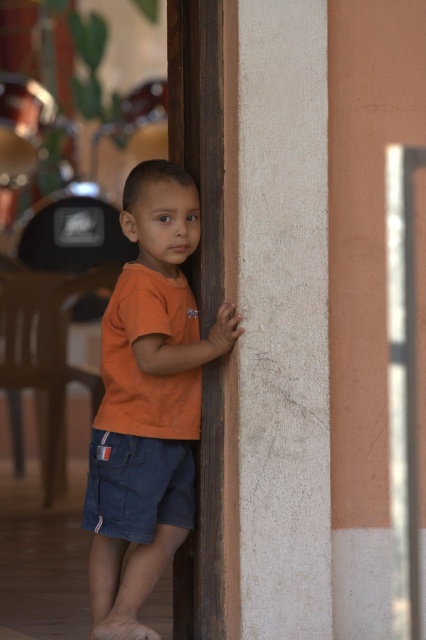
Question: Where is orange cotton shirt at center located in relation to denim shorts at lower left in the image?

Choices:
 (A) right
 (B) left

Answer: (A)

Question: Among these objects, which one is nearest to the camera?

Choices:
 (A) orange cotton shirt at center
 (B) denim shorts at lower left

Answer: (A)

Question: Which point is closer to the camera?

Choices:
 (A) orange cotton shirt at center
 (B) denim shorts at lower left

Answer: (A)

Question: Can you confirm if orange cotton shirt at center is positioned to the left of denim shorts at lower left?

Choices:
 (A) no
 (B) yes

Answer: (A)

Question: Can you confirm if orange cotton shirt at center is thinner than denim shorts at lower left?

Choices:
 (A) no
 (B) yes

Answer: (A)

Question: Which of the following is the closest to the observer?

Choices:
 (A) pos(175,508)
 (B) pos(186,385)

Answer: (B)